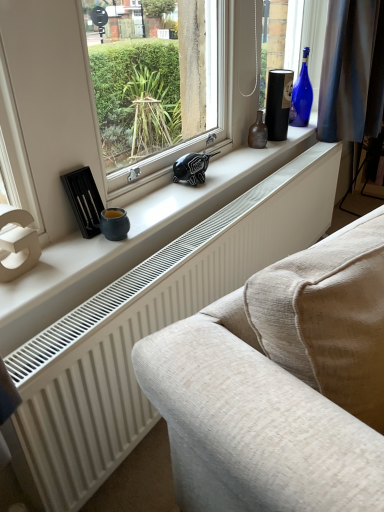
What are the coordinates of `vacant area that is in front of brown glass bottle at center, arranged as the 2th bottle when viewed from the top` in the screenshot? It's located at (249, 156).